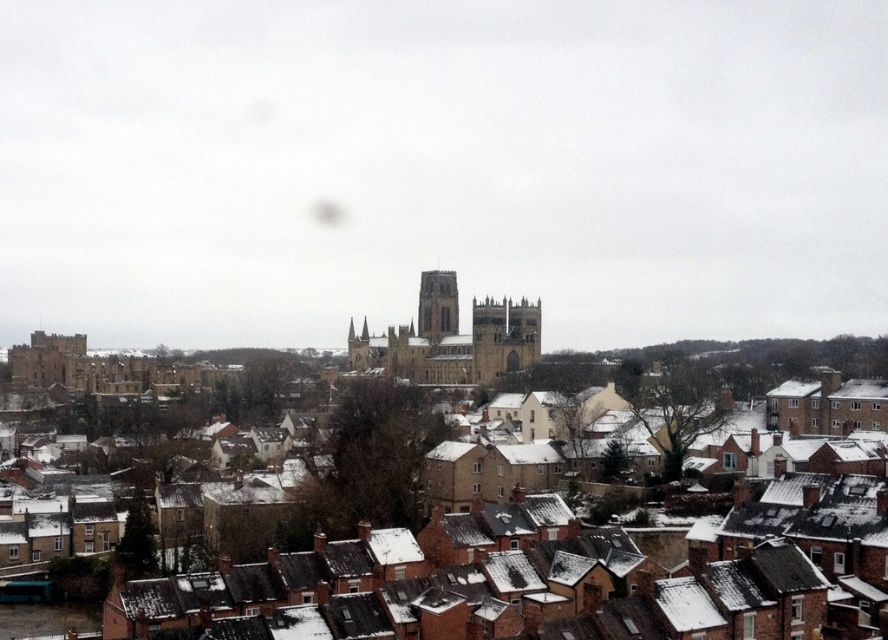
Is brown brick houses at lower center above brown stone tower at center?

Actually, brown brick houses at lower center is below brown stone tower at center.

Is brown brick houses at lower center closer to the viewer compared to brown stone tower at center?

Yes.

Locate an element on the screen. brown brick houses at lower center is located at coordinates (694, 406).